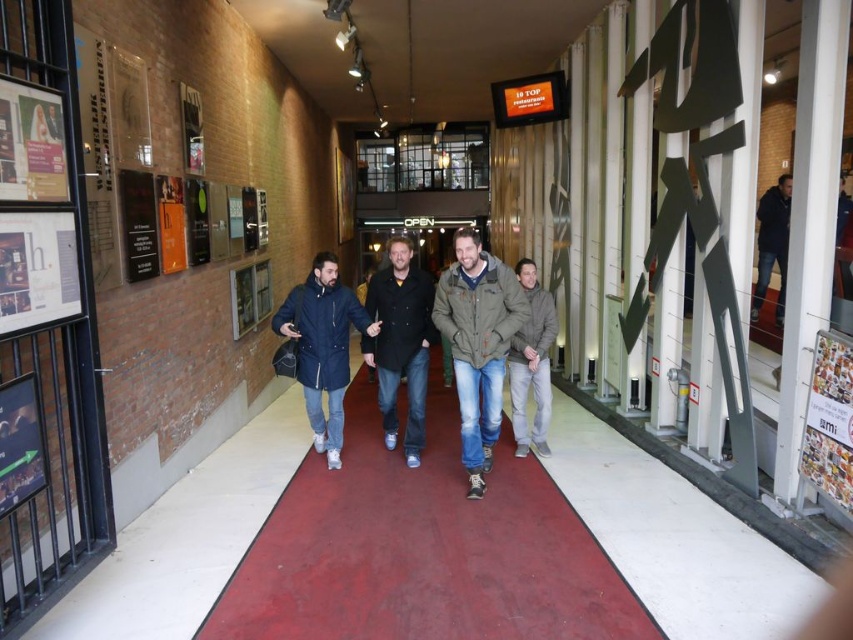
You are a tailor measuring clothing items in a fitting room. You have a gray woolen sweater at center and a dark blue jeans at right. Which clothing item has a smaller width according to the measurements?

The gray woolen sweater at center has a smaller width than the dark blue jeans at right.

You are a fashion designer observing the group in the corridor. You need to determine the spatial relationship between the gray woolen sweater at center and the dark blue jeans at right. Which one is positioned lower in the image?

The gray woolen sweater at center is positioned lower than the dark blue jeans at right in the image.